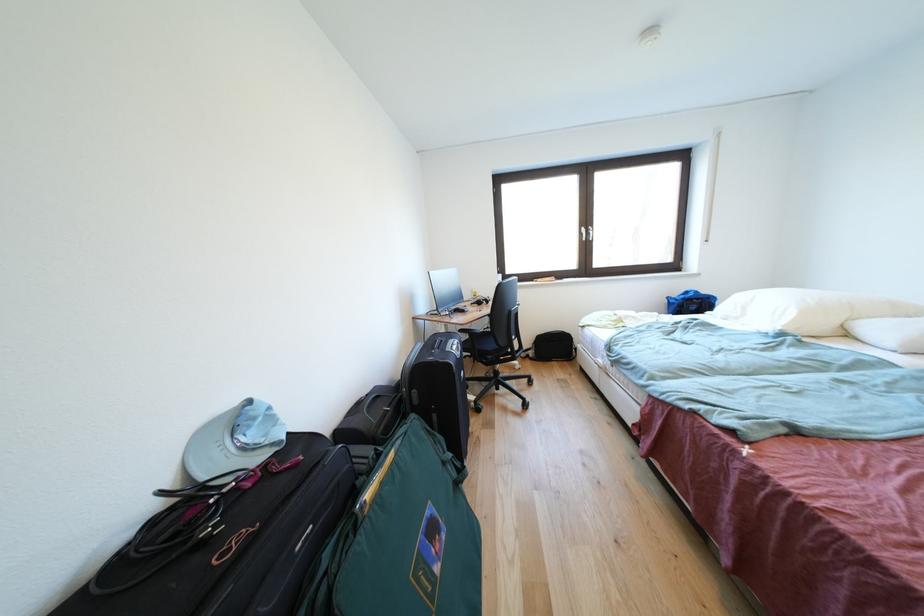
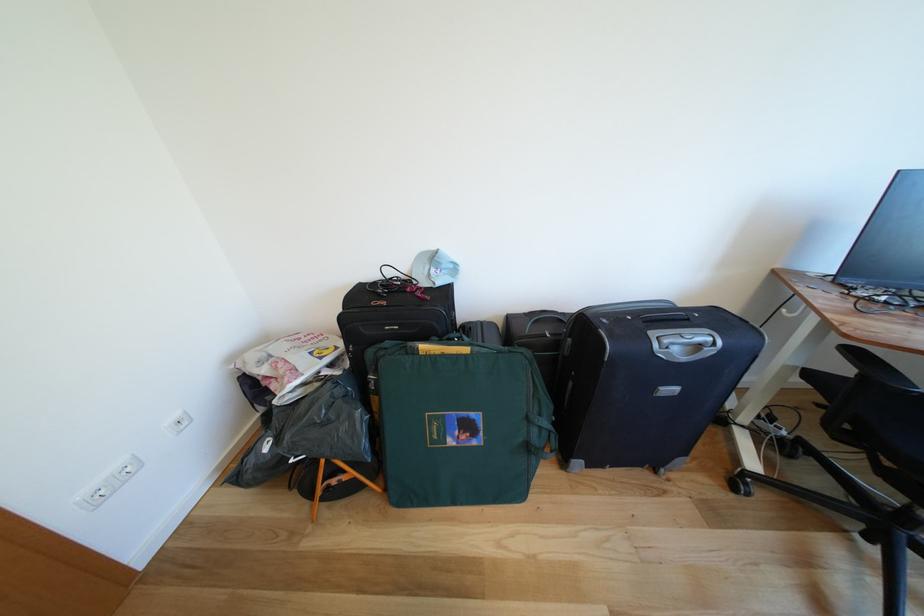
The point at (x=466, y=351) is marked in the first image. Where is the corresponding point in the second image?

(707, 351)